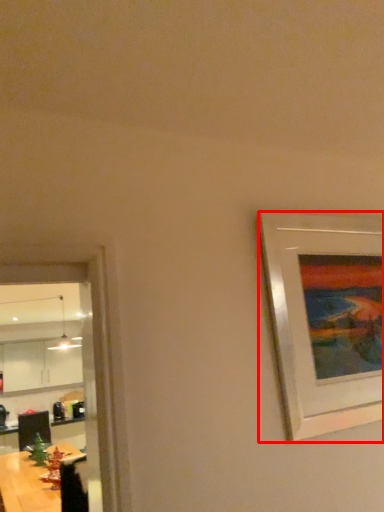
Question: From the image's perspective, where is picture frame (annotated by the red box) located relative to table?

Choices:
 (A) below
 (B) above

Answer: (B)